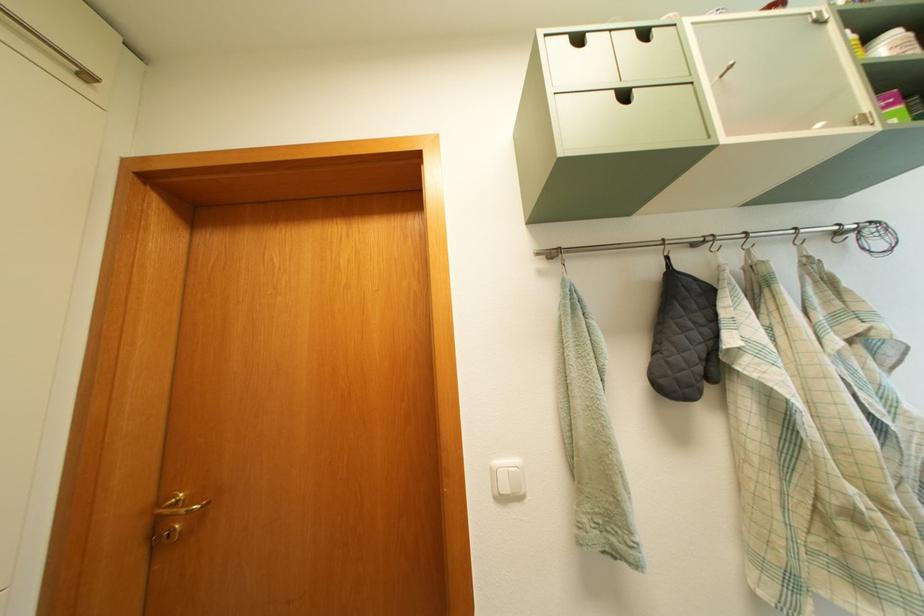
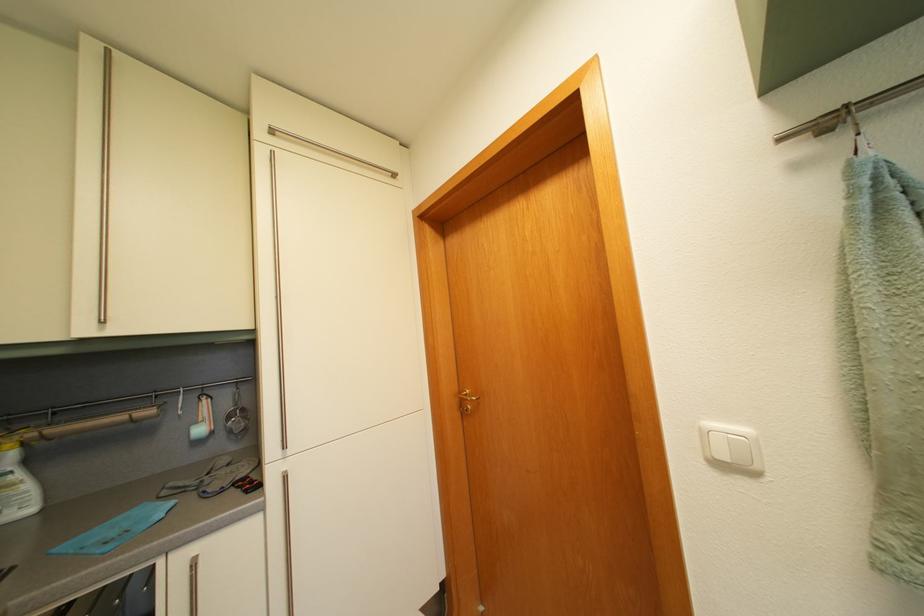
The point at [526,468] is marked in the first image. Where is the corresponding point in the second image?

(755, 438)